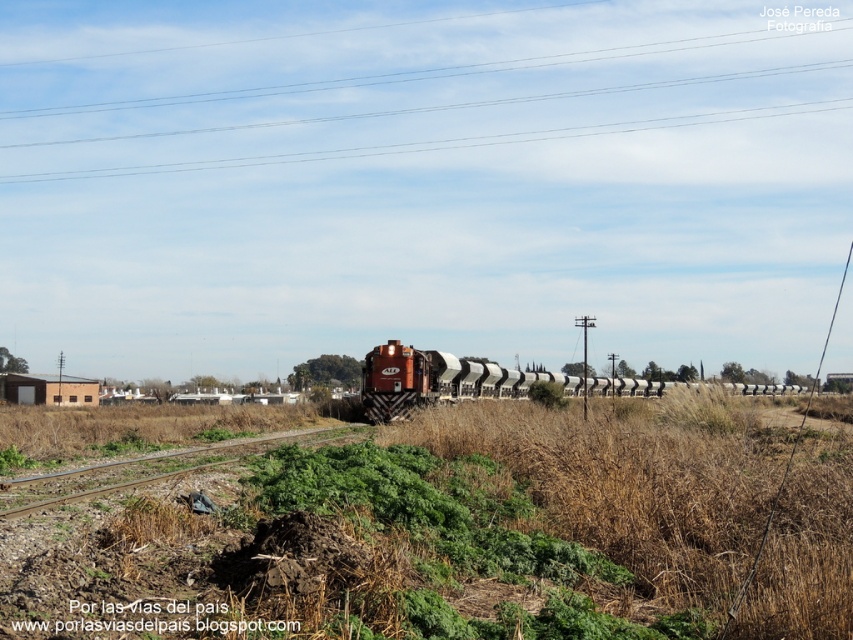
Question: Does metallic wires at upper center appear on the right side of matte orange train at center?

Choices:
 (A) no
 (B) yes

Answer: (A)

Question: Which point appears closest to the camera in this image?

Choices:
 (A) (460, 376)
 (B) (596, 58)

Answer: (A)

Question: Which object is closer to the camera taking this photo?

Choices:
 (A) matte orange train at center
 (B) brown gravel track at lower center

Answer: (B)

Question: Is matte orange train at center to the right of brown gravel track at lower center from the viewer's perspective?

Choices:
 (A) no
 (B) yes

Answer: (B)

Question: Does metallic wires at upper center appear on the left side of matte orange train at center?

Choices:
 (A) yes
 (B) no

Answer: (A)

Question: Which of these objects is positioned closest to the matte orange train at center?

Choices:
 (A) metallic wires at upper center
 (B) brown gravel track at lower center

Answer: (B)